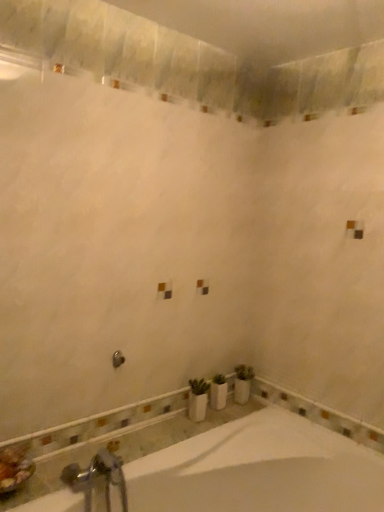
Question: Is white glossy bathtub at lower center located within silver metallic faucet at lower left?

Choices:
 (A) no
 (B) yes

Answer: (A)

Question: Is silver metallic faucet at lower left taller than white glossy bathtub at lower center?

Choices:
 (A) yes
 (B) no

Answer: (B)

Question: From the image's perspective, is silver metallic faucet at lower left located above white glossy bathtub at lower center?

Choices:
 (A) no
 (B) yes

Answer: (B)

Question: Does silver metallic faucet at lower left have a smaller size compared to white glossy bathtub at lower center?

Choices:
 (A) yes
 (B) no

Answer: (A)

Question: From a real-world perspective, does silver metallic faucet at lower left sit lower than white glossy bathtub at lower center?

Choices:
 (A) no
 (B) yes

Answer: (A)

Question: Does silver metallic faucet at lower left lie in front of white glossy bathtub at lower center?

Choices:
 (A) yes
 (B) no

Answer: (B)

Question: Is white ceramic vase at lower center beside silver metallic faucet at lower left?

Choices:
 (A) yes
 (B) no

Answer: (B)

Question: From a real-world perspective, is white ceramic vase at lower center positioned over silver metallic faucet at lower left based on gravity?

Choices:
 (A) no
 (B) yes

Answer: (B)

Question: Does white ceramic vase at lower center come behind silver metallic faucet at lower left?

Choices:
 (A) yes
 (B) no

Answer: (A)

Question: Would you say white ceramic vase at lower center is a long distance from silver metallic faucet at lower left?

Choices:
 (A) yes
 (B) no

Answer: (B)

Question: Is white ceramic vase at lower center oriented towards silver metallic faucet at lower left?

Choices:
 (A) yes
 (B) no

Answer: (B)

Question: Considering the relative sizes of white ceramic vase at lower center and silver metallic faucet at lower left in the image provided, is white ceramic vase at lower center taller than silver metallic faucet at lower left?

Choices:
 (A) no
 (B) yes

Answer: (A)

Question: Is brushed metal shower at center positioned behind white ceramic vase at lower center?

Choices:
 (A) yes
 (B) no

Answer: (B)